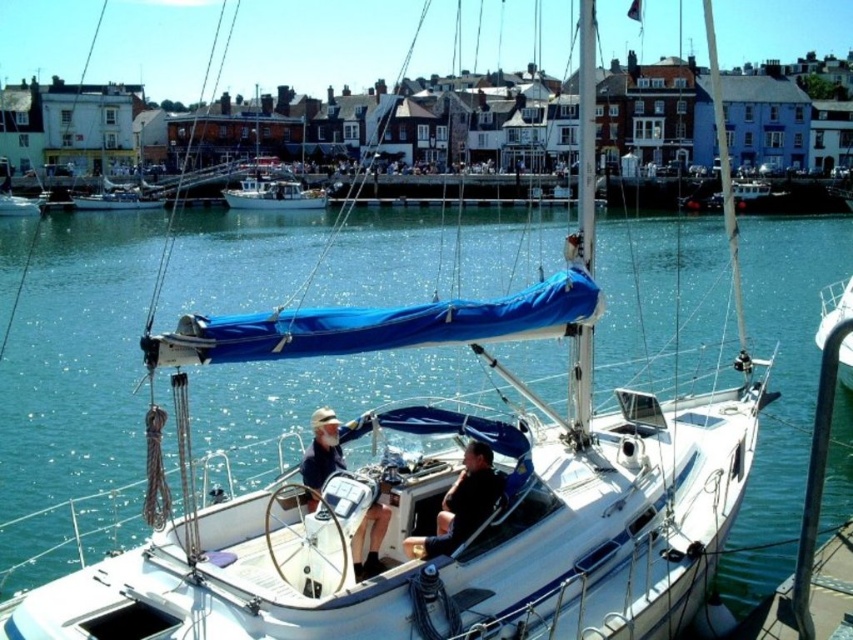
Between point (323, 196) and point (851, 355), which one is positioned in front?

Point (851, 355)

Find the location of a particular element. white matte boat at center is located at coordinates (273, 195).

Is black fabric at center further to camera compared to white glossy sailboat at center?

No, black fabric at center is closer to the viewer.

The image size is (853, 640). In order to click on black fabric at center in this screenshot , I will do `click(461, 504)`.

I want to click on matte blue shirt at center, so click(322, 449).

Is point (329, 474) more distant than point (840, 381)?

No, it is in front of (840, 381).

Locate an element on the screen. The width and height of the screenshot is (853, 640). matte blue shirt at center is located at coordinates (322, 449).